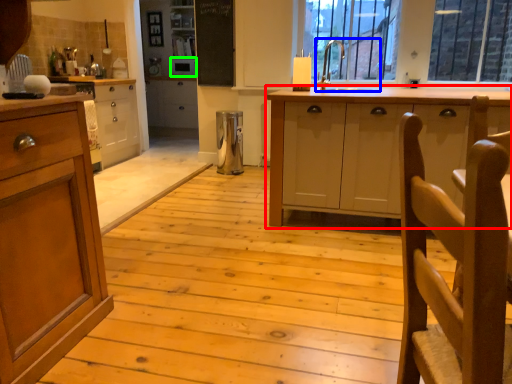
Question: Considering the real-world distances, which object is closest to cabinetry (highlighted by a red box)? sink (highlighted by a blue box) or appliance (highlighted by a green box).

Choices:
 (A) sink
 (B) appliance

Answer: (A)